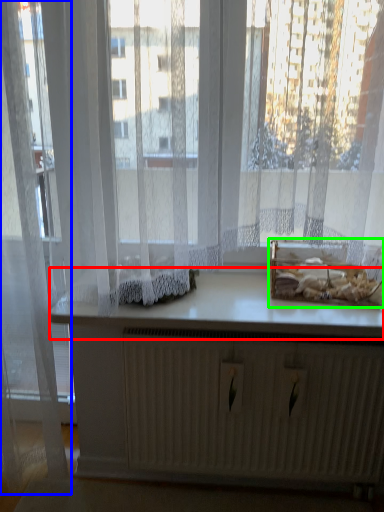
Question: Which object is positioned farthest from counter top (highlighted by a red box)? Select from curtain (highlighted by a blue box) and cardboard box (highlighted by a green box).

Choices:
 (A) curtain
 (B) cardboard box

Answer: (A)